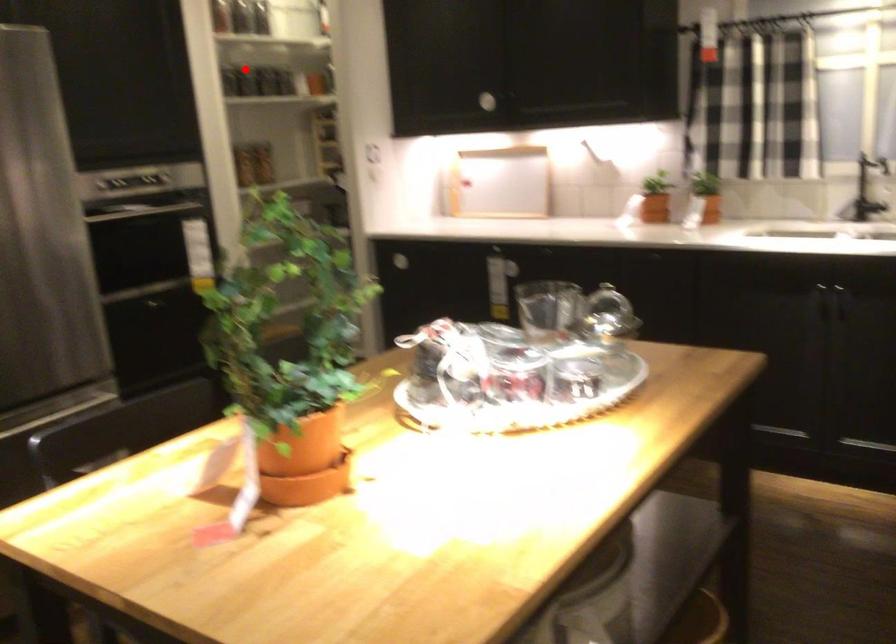
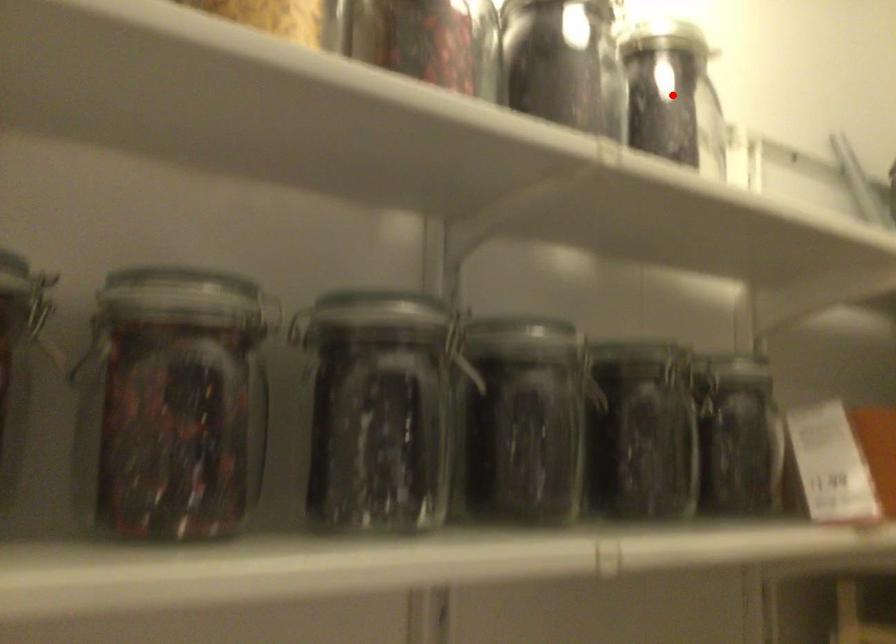
I am providing you with two images of the same scene from different viewpoints. A red point is marked on the first image and another point is marked on the second image. Does the point marked in image1 correspond to the same location as the one in image2?

No